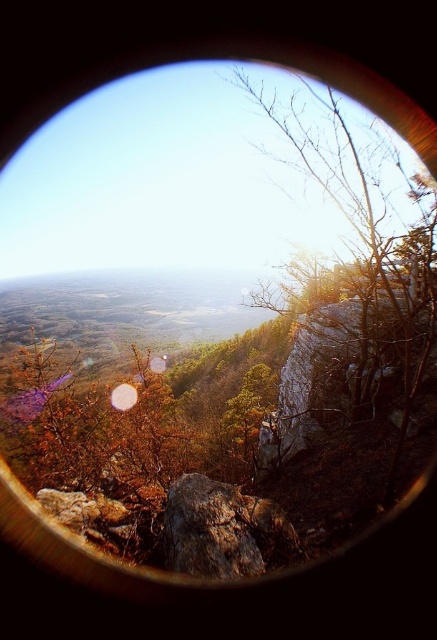
You are a photographer holding a camera with a transparent glass lens at center. You want to capture a photo of the brown textured tree at right without it being too small in the frame. Should you zoom in or out to ensure the tree fills more of the image?

The brown textured tree at right is wider than the transparent glass lens at center, so zooming out would allow the tree to fill more of the frame while keeping it in focus. Zooming in might make the tree appear smaller due to the lens size difference.

In the scene shown: You are a hiker planning to take a photo of the brown textured tree at right and the rusty rock at center. Based on their positions in the scene, which object should you focus on first to ensure both are in frame without moving the camera?

The brown textured tree at right is taller than the rusty rock at center, so you should focus on the brown textured tree at right first to ensure both are in frame without moving the camera.